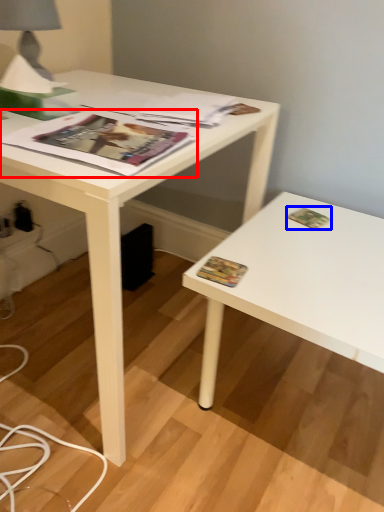
Question: Which object is closer to the camera taking this photo, magazine (highlighted by a red box) or paperback book (highlighted by a blue box)?

Choices:
 (A) magazine
 (B) paperback book

Answer: (A)